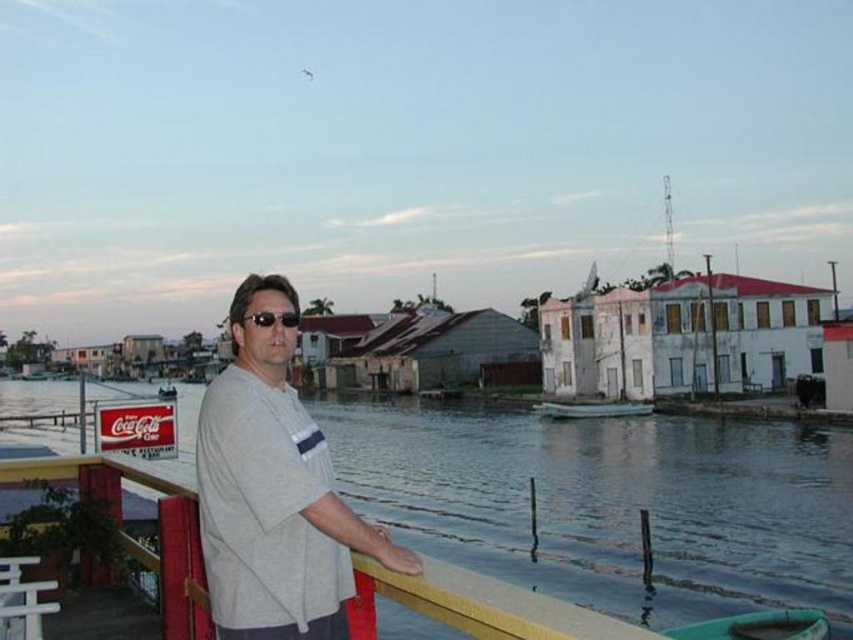
Can you confirm if smooth water at center is smaller than matte black sunglasses at center?

Incorrect, smooth water at center is not smaller in size than matte black sunglasses at center.

Does smooth water at center lie behind matte black sunglasses at center?

That is False.

What do you see at coordinates (611, 502) in the screenshot? I see `smooth water at center` at bounding box center [611, 502].

Image resolution: width=853 pixels, height=640 pixels. What are the coordinates of `smooth water at center` in the screenshot? It's located at (611, 502).

Can you confirm if smooth water at center is positioned below gray cotton shirt at center?

Indeed, smooth water at center is positioned under gray cotton shirt at center.

Who is more forward, (532, 563) or (316, 520)?

Positioned in front is point (316, 520).

You are a GUI agent. You are given a task and a screenshot of the screen. Output one action in this format:
    pyautogui.click(x=<x>, y=<y>)
    Task: Click on the smooth water at center
    
    Given the screenshot: What is the action you would take?
    pyautogui.click(x=611, y=502)

Which is above, smooth water at center or white matte boat at center?

white matte boat at center is higher up.

Can you confirm if smooth water at center is wider than white matte boat at center?

Yes, smooth water at center is wider than white matte boat at center.

Is point (607, 488) positioned behind point (646, 413)?

No.

Locate an element on the screen. smooth water at center is located at coordinates (611, 502).